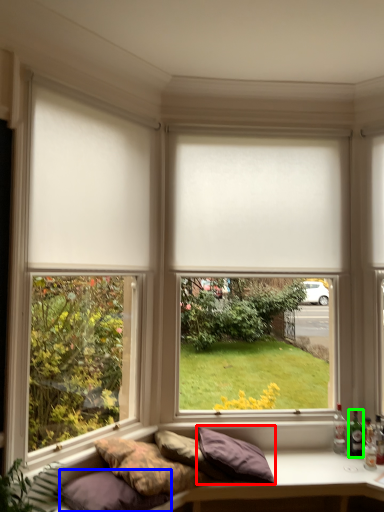
Question: Which is nearer to the pillow (highlighted by a red box)? pillow (highlighted by a blue box) or bottle (highlighted by a green box).

Choices:
 (A) pillow
 (B) bottle

Answer: (A)